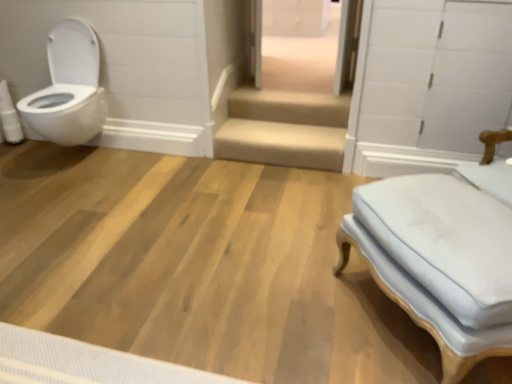
Locate an element on the screen. The height and width of the screenshot is (384, 512). vacant space to the left of white fabric ottoman at right is located at coordinates (294, 308).